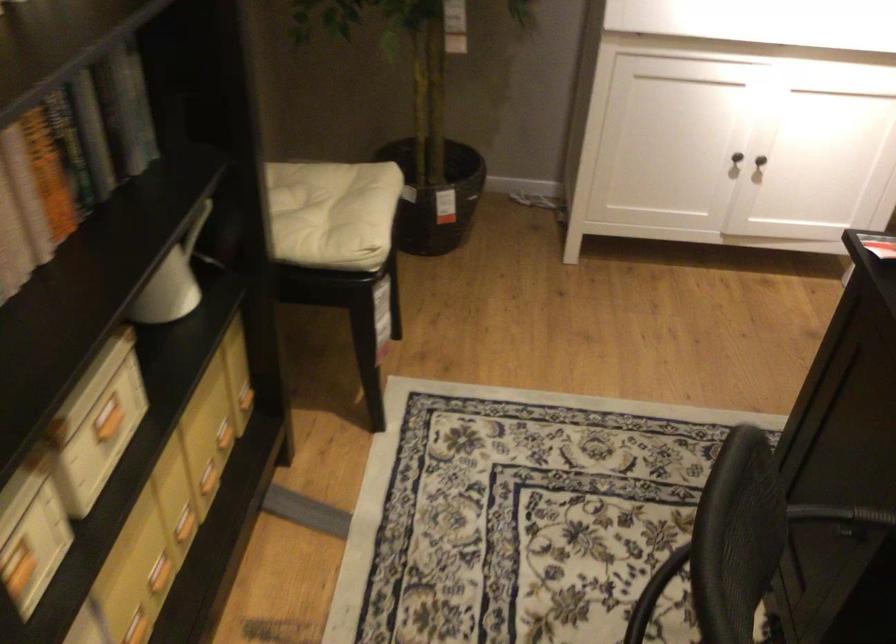
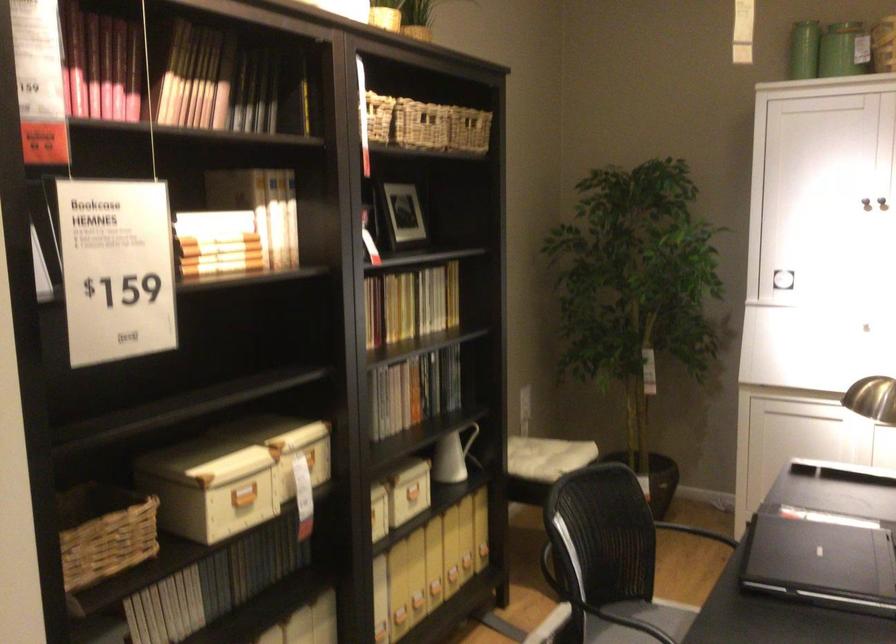
Where in the second image is the point corresponding to [130,386] from the first image?

(418, 491)